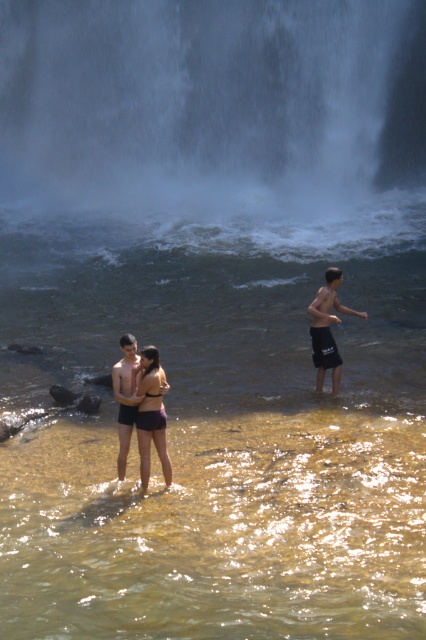
Is white misty waterfall at upper center below matte black shorts at center?

No, white misty waterfall at upper center is not below matte black shorts at center.

This screenshot has width=426, height=640. Describe the element at coordinates (210, 104) in the screenshot. I see `white misty waterfall at upper center` at that location.

Where is `white misty waterfall at upper center`? Image resolution: width=426 pixels, height=640 pixels. white misty waterfall at upper center is located at coordinates (210, 104).

Looking at this image, how distant is purple matte shorts at center from matte black shorts at center?

They are 12.18 inches apart.

Is point (163, 412) behind point (114, 374)?

No, (163, 412) is in front of (114, 374).

At what (x,y) coordinates should I click in order to perform the action: click on purple matte shorts at center. Please return your answer as a coordinate pair (x, y). The width and height of the screenshot is (426, 640). Looking at the image, I should click on (150, 412).

Between white misty waterfall at upper center and dark gray shorts at right, which one has less height?

With less height is dark gray shorts at right.

At what (x,y) coordinates should I click in order to perform the action: click on white misty waterfall at upper center. Please return your answer as a coordinate pair (x, y). The height and width of the screenshot is (640, 426). Looking at the image, I should click on (210, 104).